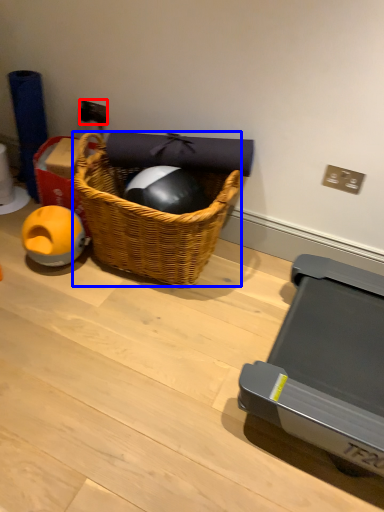
Question: Among these objects, which one is nearest to the camera, power outlet (highlighted by a red box) or picnic basket (highlighted by a blue box)?

Choices:
 (A) power outlet
 (B) picnic basket

Answer: (B)